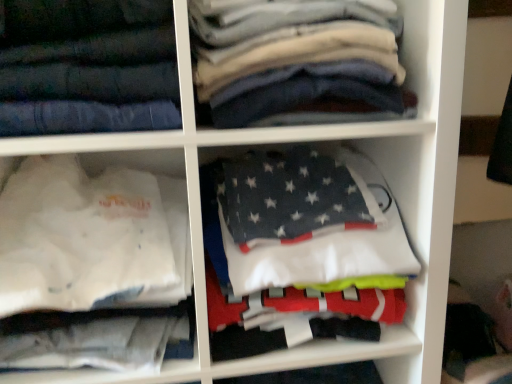
Question: Would you consider dark gray cotton shirts at upper center to be distant from dark gray fleece blanket at center, the 2th cabinet in the left-to-right sequence?

Choices:
 (A) yes
 (B) no

Answer: (B)

Question: Is dark gray cotton shirts at upper center beside dark gray fleece blanket at center, the 2th cabinet in the left-to-right sequence?

Choices:
 (A) no
 (B) yes

Answer: (A)

Question: Is dark gray cotton shirts at upper center smaller than dark gray fleece blanket at center, the 2th cabinet in the left-to-right sequence?

Choices:
 (A) yes
 (B) no

Answer: (B)

Question: From the image's perspective, is dark gray cotton shirts at upper center below dark gray fleece blanket at center, the first cabinet positioned from the right?

Choices:
 (A) no
 (B) yes

Answer: (A)

Question: Is dark gray cotton shirts at upper center oriented towards dark gray fleece blanket at center, the 2th cabinet in the left-to-right sequence?

Choices:
 (A) no
 (B) yes

Answer: (A)

Question: Looking at the image, does white fabric shirt at lower left, marked as the first cabinet in a left-to-right arrangement, seem bigger or smaller compared to dark gray fleece blanket at center, the 2th cabinet in the left-to-right sequence?

Choices:
 (A) big
 (B) small

Answer: (A)

Question: Is white fabric shirt at lower left, marked as the first cabinet in a left-to-right arrangement, wider or thinner than dark gray fleece blanket at center, the 2th cabinet in the left-to-right sequence?

Choices:
 (A) thin
 (B) wide

Answer: (B)

Question: From the image's perspective, relative to dark gray fleece blanket at center, the first cabinet positioned from the right, is white fabric shirt at lower left, the 2th cabinet from the right, above or below?

Choices:
 (A) below
 (B) above

Answer: (A)

Question: Considering the positions of point click(161, 220) and point click(348, 221), is point click(161, 220) closer or farther from the camera than point click(348, 221)?

Choices:
 (A) closer
 (B) farther

Answer: (B)

Question: In the image, is white fabric shirt at lower left, marked as the first cabinet in a left-to-right arrangement, positioned in front of or behind dark blue denim jeans at upper left?

Choices:
 (A) behind
 (B) front

Answer: (A)

Question: In the image, is white fabric shirt at lower left, the 2th cabinet from the right, on the left side or the right side of dark blue denim jeans at upper left?

Choices:
 (A) right
 (B) left

Answer: (A)

Question: Choose the correct answer: Is white fabric shirt at lower left, marked as the first cabinet in a left-to-right arrangement, inside dark blue denim jeans at upper left or outside it?

Choices:
 (A) outside
 (B) inside

Answer: (A)

Question: Looking at their shapes, would you say white fabric shirt at lower left, marked as the first cabinet in a left-to-right arrangement, is wider or thinner than dark blue denim jeans at upper left?

Choices:
 (A) thin
 (B) wide

Answer: (B)

Question: From their relative heights in the image, would you say dark gray fleece blanket at center, the 2th cabinet in the left-to-right sequence, is taller or shorter than white fabric shirt at lower left, marked as the first cabinet in a left-to-right arrangement?

Choices:
 (A) tall
 (B) short

Answer: (B)

Question: Which is correct: dark gray fleece blanket at center, the first cabinet positioned from the right, is inside white fabric shirt at lower left, the 2th cabinet from the right, or outside of it?

Choices:
 (A) outside
 (B) inside

Answer: (A)